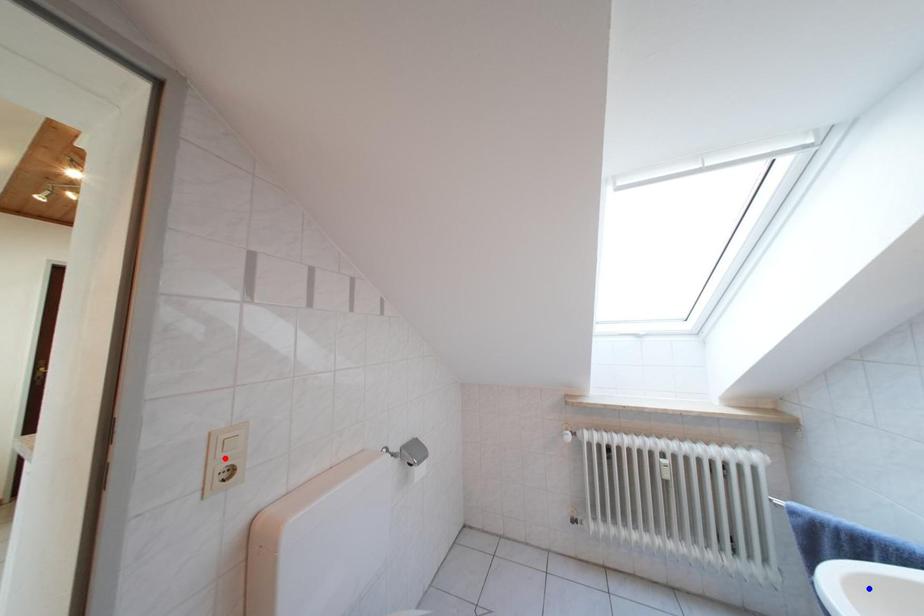
Question: In the image, two points are highlighted. Which point is nearer to the camera? Reply with the corresponding letter.

Choices:
 (A) blue point
 (B) red point

Answer: (A)